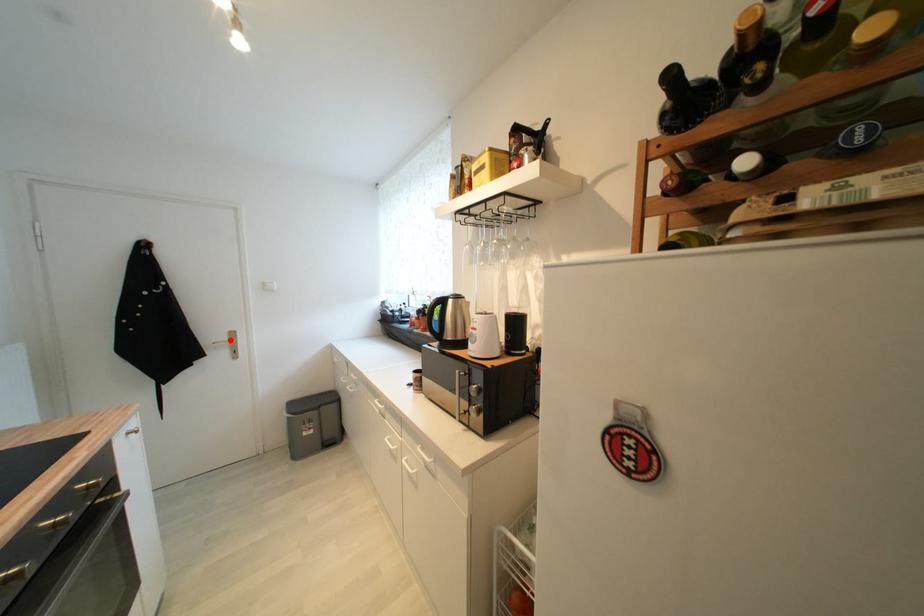
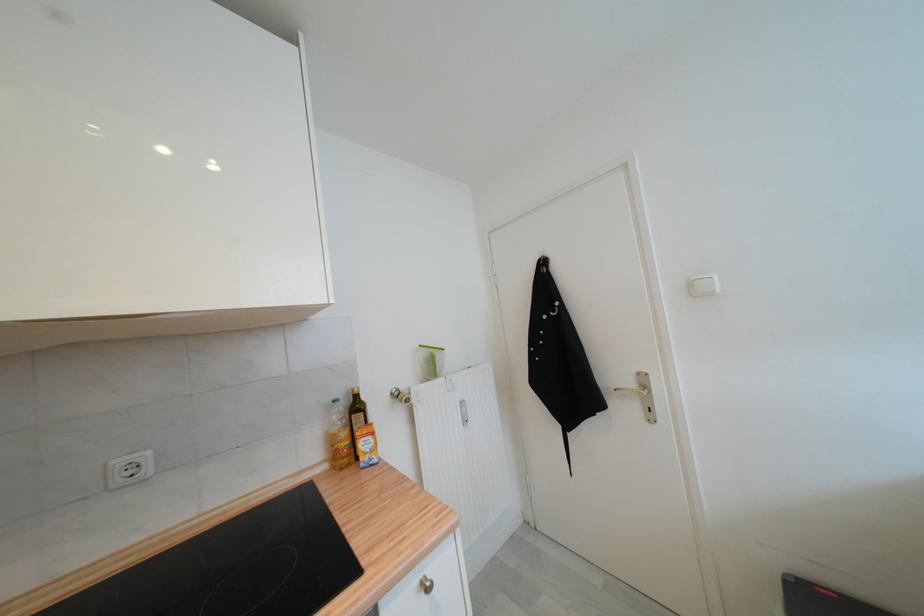
Question: I am providing you with two images of the same scene from different viewpoints. A red point is marked on the first image. Can you still see the location of the red point in image 2?

Choices:
 (A) Yes
 (B) No

Answer: (A)